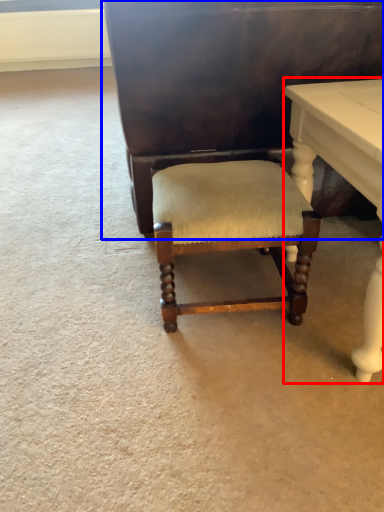
Question: Among these objects, which one is nearest to the camera, table (highlighted by a red box) or vanity (highlighted by a blue box)?

Choices:
 (A) table
 (B) vanity

Answer: (A)